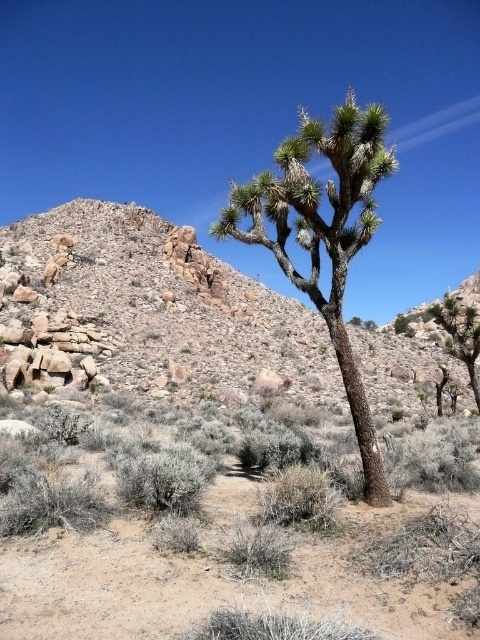
Question: Which of the following is the closest to the observer?

Choices:
 (A) (136, 346)
 (B) (456, 321)

Answer: (B)

Question: Can you confirm if rocky desert at upper left is positioned to the right of green spiky plant at right?

Choices:
 (A) no
 (B) yes

Answer: (A)

Question: Based on their relative distances, which object is nearer to the rocky desert at upper left?

Choices:
 (A) green spiky plant at right
 (B) green spiky tree at center

Answer: (A)

Question: Based on their relative distances, which object is farther from the green spiky tree at center?

Choices:
 (A) green spiky plant at right
 (B) rocky desert at upper left

Answer: (A)

Question: Does rocky desert at upper left have a smaller size compared to green spiky tree at center?

Choices:
 (A) no
 (B) yes

Answer: (B)

Question: Does green spiky tree at center have a larger size compared to green spiky plant at right?

Choices:
 (A) no
 (B) yes

Answer: (B)